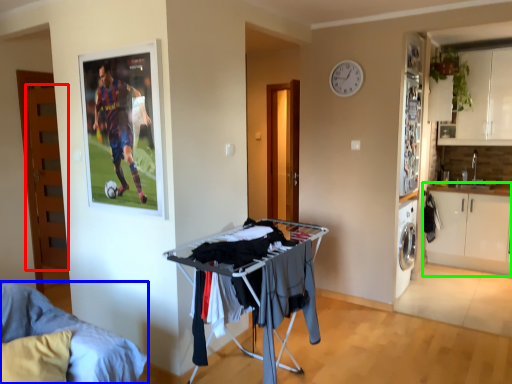
Question: Which object is the closest to the door (highlighted by a red box)? Choose among these: furniture (highlighted by a blue box) or cabinetry (highlighted by a green box).

Choices:
 (A) furniture
 (B) cabinetry

Answer: (A)